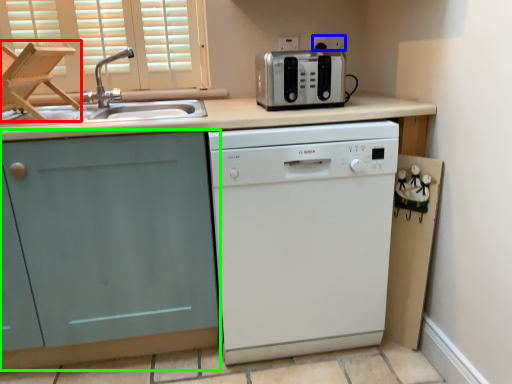
Question: Considering the real-world distances, which object is closest to folding chair (highlighted by a red box)? electric outlet (highlighted by a blue box) or cabinetry (highlighted by a green box).

Choices:
 (A) electric outlet
 (B) cabinetry

Answer: (B)